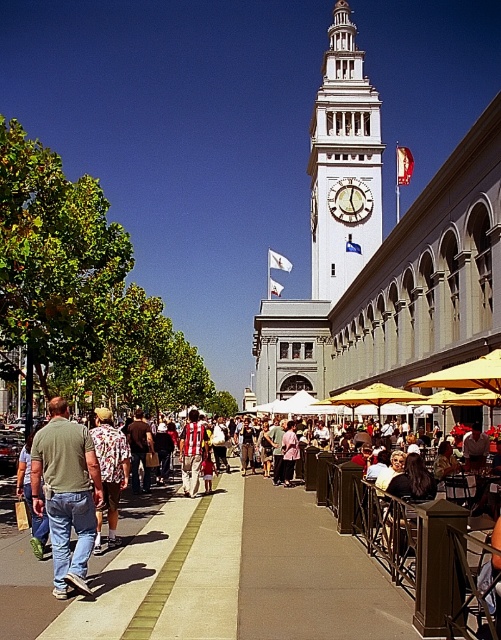
You are a photographer standing in front of the clock tower. You want to take a photo that includes both the floral shirt at left and the wooden clock at center. Which object will appear larger in the photo?

The floral shirt at left will appear larger in the photo because it is bigger than the wooden clock at center.

You are a tourist standing on the walkway in front of the clock tower. You notice the white stone clock tower at center and the matte green shirt at center. Which object is wider from your perspective?

The white stone clock tower at center is wider than the matte green shirt at center.